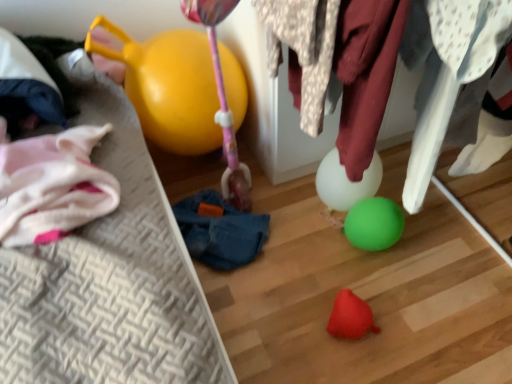
This screenshot has width=512, height=384. Identify the location of vacant area located to the right-hand side of blue fabric bean bag chair at center. (303, 234).